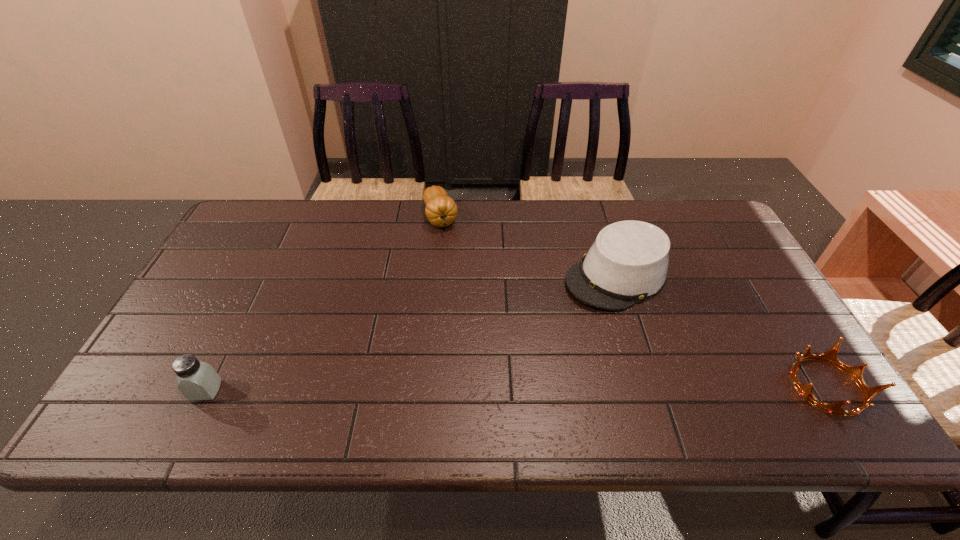
In order to click on vacant space on the desktop that is between the leftmost object and the shortest object and is positioned on the front-facing side of the hat in this screenshot , I will do `click(435, 389)`.

This screenshot has height=540, width=960. Identify the location of vacant space on the desktop that is between the saltshaker and the rightmost object and is positioned on the stem side of the gourd. (504, 388).